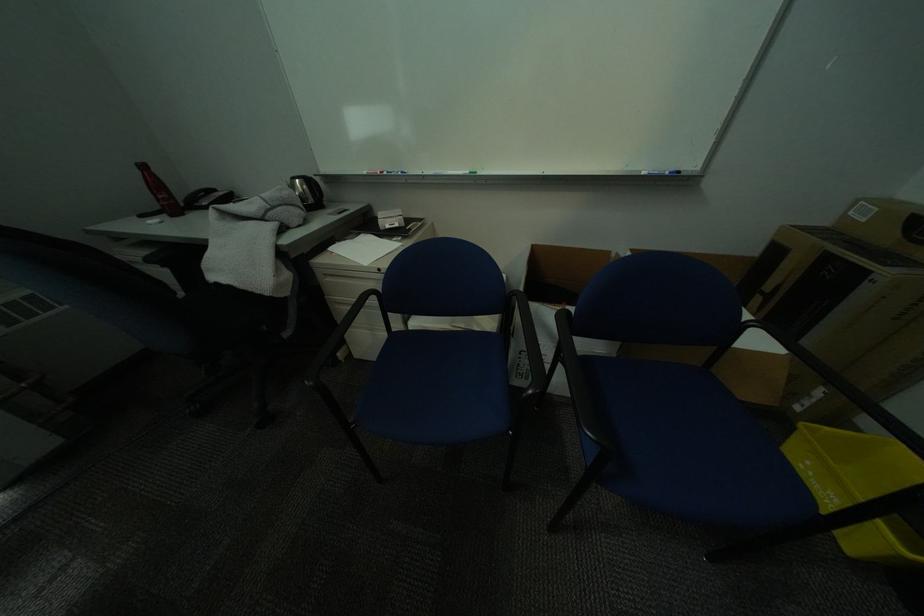
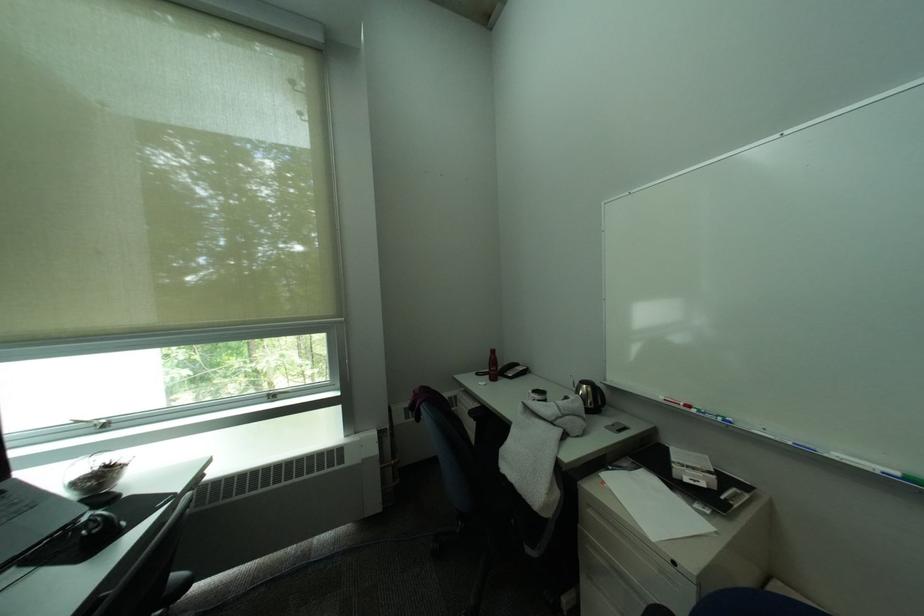
In the second image, find the point that corresponds to (x=405, y=175) in the first image.

(719, 416)